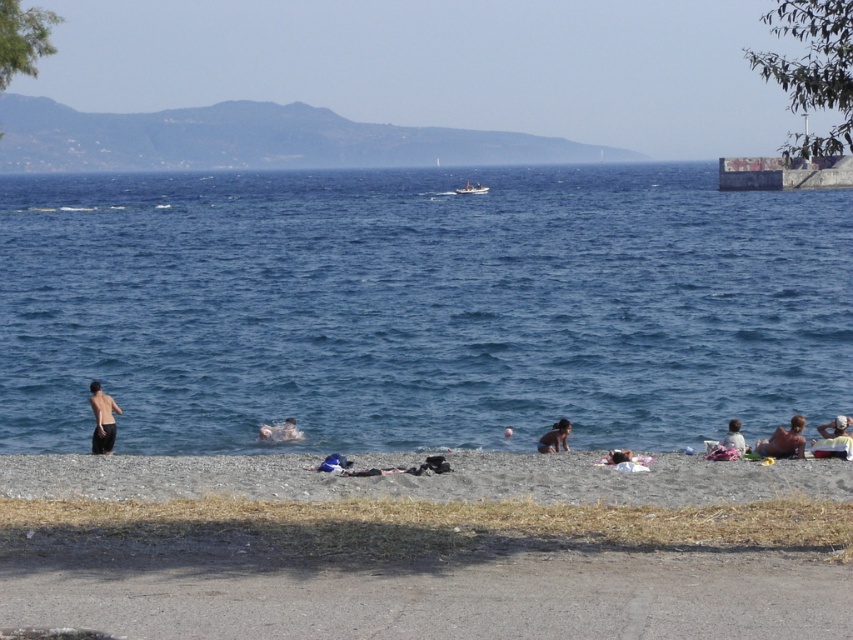
Question: Does gravelly sand beach at lower center have a smaller size compared to smooth skin torso at lower left?

Choices:
 (A) no
 (B) yes

Answer: (A)

Question: Is smooth skin torso at lower left to the left of beige fabric towel at lower right from the viewer's perspective?

Choices:
 (A) yes
 (B) no

Answer: (A)

Question: Is smooth skin person at center thinner than white matte swim cap at upper center?

Choices:
 (A) yes
 (B) no

Answer: (B)

Question: Which point is closer to the camera taking this photo?

Choices:
 (A) (247, 300)
 (B) (299, 433)
 (C) (462, 189)
 (D) (792, 435)

Answer: (D)

Question: Among these points, which one is nearest to the camera?

Choices:
 (A) (112, 417)
 (B) (527, 456)
 (C) (799, 451)

Answer: (C)

Question: Which of these objects is positioned closest to the white matte swim cap at upper center?

Choices:
 (A) gravelly sand beach at lower center
 (B) beige fabric towel at lower right
 (C) smooth skin person at center

Answer: (B)